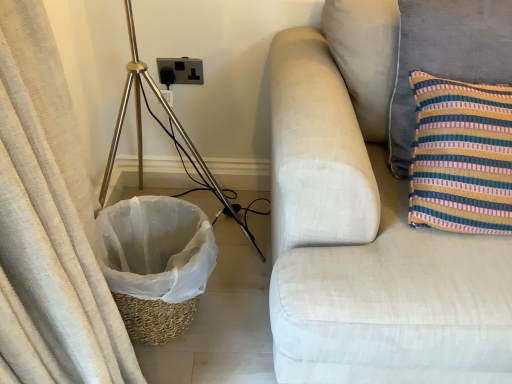
Question: Considering the positions of striped fabric pillow at right and black plastic outlet at center in the image, is striped fabric pillow at right taller or shorter than black plastic outlet at center?

Choices:
 (A) short
 (B) tall

Answer: (B)

Question: From the image's perspective, is striped fabric pillow at right above or below black plastic outlet at center?

Choices:
 (A) above
 (B) below

Answer: (B)

Question: Which of these objects is positioned closest to the light beige fabric couch at right?

Choices:
 (A) striped fabric pillow at right
 (B) braided straw laundry basket at lower left
 (C) gold metallic tripod at left
 (D) black plastic outlet at center

Answer: (A)

Question: Estimate the real-world distances between objects in this image. Which object is farther from the striped fabric pillow at right?

Choices:
 (A) black plastic outlet at center
 (B) light beige fabric couch at right
 (C) braided straw laundry basket at lower left
 (D) gold metallic tripod at left

Answer: (A)